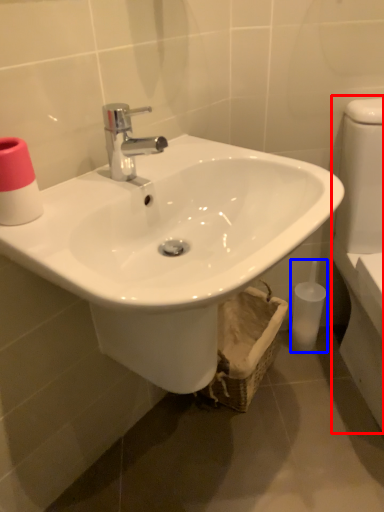
Question: Which of the following is the closest to the observer, porcelain (highlighted by a red box) or toiletry (highlighted by a blue box)?

Choices:
 (A) porcelain
 (B) toiletry

Answer: (A)